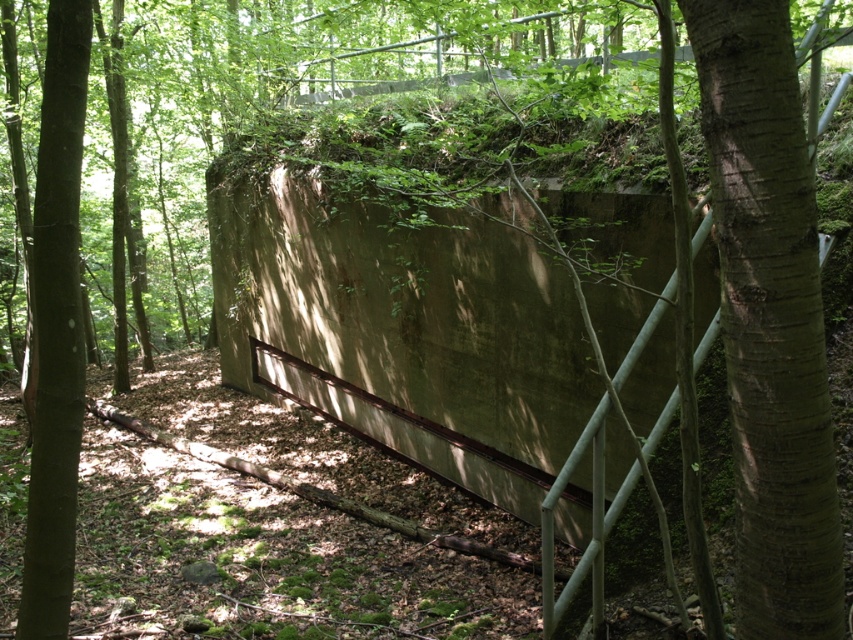
Question: Which point is farther to the camera?

Choices:
 (A) green rough bark tree at center right
 (B) brown rough bark tree at left

Answer: (B)

Question: Does green rough bark tree at center right come behind brown rough bark tree at left?

Choices:
 (A) yes
 (B) no

Answer: (B)

Question: Does green rough bark tree at center right have a smaller size compared to brown rough bark tree at left?

Choices:
 (A) no
 (B) yes

Answer: (B)

Question: Does green rough bark tree at center right have a smaller size compared to brown rough bark tree at left?

Choices:
 (A) no
 (B) yes

Answer: (B)

Question: Which point is closer to the camera?

Choices:
 (A) (813, 461)
 (B) (64, 156)

Answer: (A)